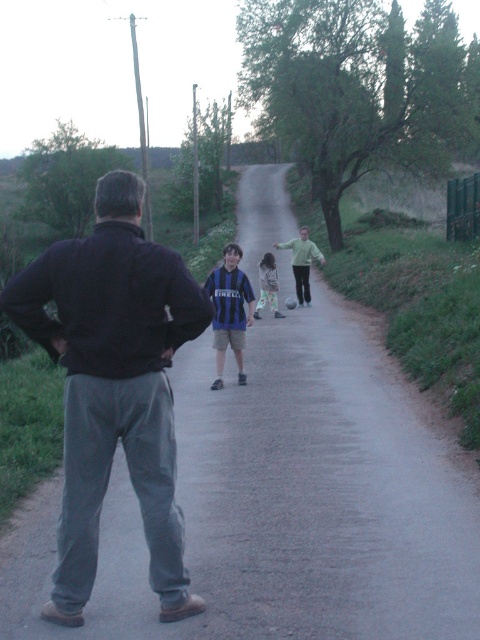
Question: Where is dark gray sweatpants at center located in relation to green fleece jacket at center in the image?

Choices:
 (A) above
 (B) below

Answer: (B)

Question: Based on their relative distances, which object is nearer to the blue striped jersey at center?

Choices:
 (A) dark gray sweatpants at center
 (B) green fleece jacket at center

Answer: (A)

Question: Is dark gray sweatpants at center to the right of green fleece jacket at center from the viewer's perspective?

Choices:
 (A) yes
 (B) no

Answer: (B)

Question: Does green fleece jacket at center appear on the left side of light brown fabric dress at center?

Choices:
 (A) no
 (B) yes

Answer: (A)

Question: Among these points, which one is nearest to the camera?

Choices:
 (A) (260, 298)
 (B) (302, 250)
 (C) (237, 282)
 (D) (75, 257)

Answer: (D)

Question: Which object is closer to the camera taking this photo?

Choices:
 (A) dark gray sweatpants at center
 (B) green fleece jacket at center

Answer: (A)